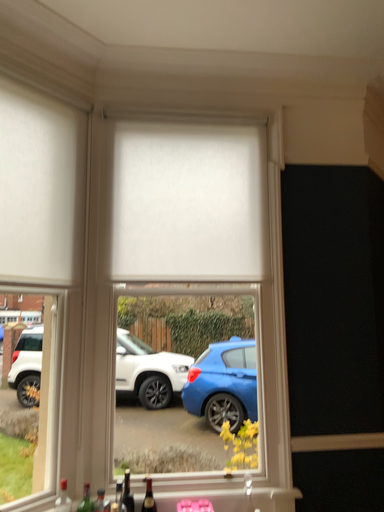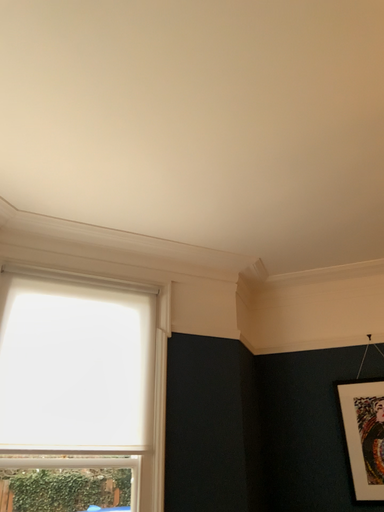
Question: Which way did the camera rotate in the video?

Choices:
 (A) rotated left
 (B) rotated right

Answer: (B)